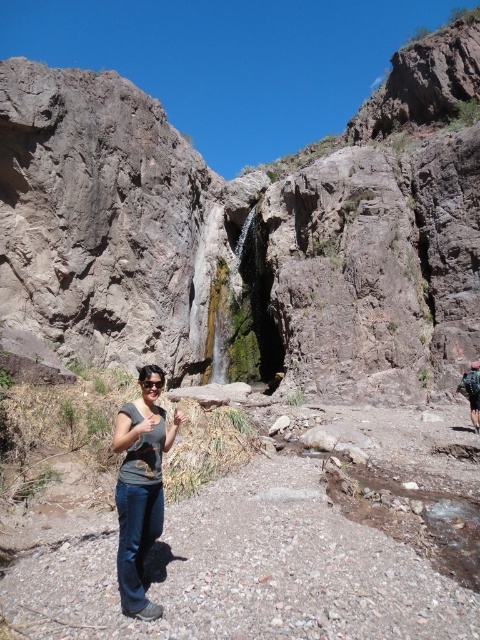
Image resolution: width=480 pixels, height=640 pixels. In order to click on gray matte shirt at center in this screenshot , I will do [x=141, y=486].

Locate an element on the screen. The width and height of the screenshot is (480, 640). gray matte shirt at center is located at coordinates (141, 486).

Does point (404, 300) come behind point (474, 426)?

Yes, it is behind point (474, 426).

Who is positioned more to the left, brown rocky canyon at center or dark blue backpack at right?

brown rocky canyon at center

Locate an element on the screen. The image size is (480, 640). brown rocky canyon at center is located at coordinates (242, 224).

Describe the element at coordinates (242, 224) in the screenshot. I see `brown rocky canyon at center` at that location.

Does brown rocky canyon at center come in front of gray matte shirt at center?

That is False.

The image size is (480, 640). Find the location of `brown rocky canyon at center`. brown rocky canyon at center is located at coordinates (242, 224).